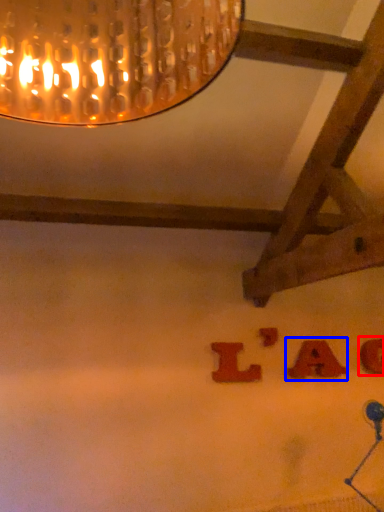
Question: Among these objects, which one is farthest to the camera, alphabet (highlighted by a red box) or alphabet (highlighted by a blue box)?

Choices:
 (A) alphabet
 (B) alphabet

Answer: (A)